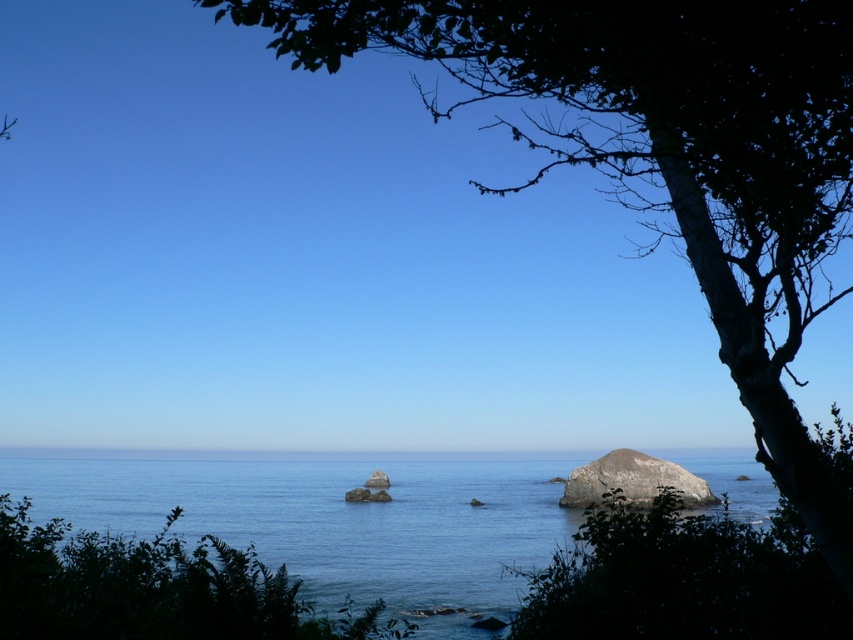
Between point (498, 518) and point (61, 563), which one is positioned in front?

Positioned in front is point (61, 563).

Between blue water at center and green leafy tree at lower left, which one is positioned lower?

blue water at center is lower down.

Measure the distance between blue water at center and camera.

blue water at center is 7.42 meters from camera.

This screenshot has height=640, width=853. In order to click on blue water at center in this screenshot , I will do `click(329, 516)`.

Is point (772, 442) positioned in front of point (70, 595)?

That is True.

Can you confirm if green leafy tree at upper right is taller than green leafy tree at lower left?

Indeed, green leafy tree at upper right has a greater height compared to green leafy tree at lower left.

Between point (596, 102) and point (392, 632), which one is positioned in front?

Positioned in front is point (392, 632).

In order to click on green leafy tree at upper right in this screenshot , I will do `click(664, 152)`.

Is green leafy tree at lower left taller than smooth gray rock at center?

Correct, green leafy tree at lower left is much taller as smooth gray rock at center.

Is point (77, 532) more distant than point (664, 467)?

No, (77, 532) is in front of (664, 467).

Is point (41, 579) farther from viewer compared to point (590, 477)?

No.

This screenshot has width=853, height=640. I want to click on green leafy tree at lower left, so click(x=154, y=588).